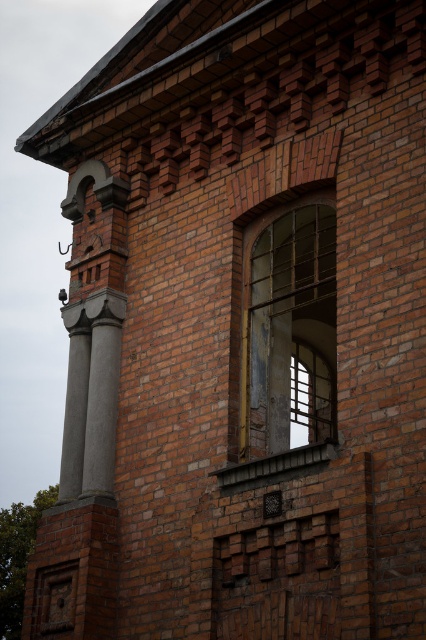
The image size is (426, 640). Identify the location of gray concrete column at left. (101, 390).

From the picture: Is gray concrete column at left to the left of smooth concrete column at center from the viewer's perspective?

No, gray concrete column at left is not to the left of smooth concrete column at center.

Is point (112, 392) positioned in front of point (69, 436)?

Yes, it is in front of point (69, 436).

Locate an element on the screen. gray concrete column at left is located at coordinates (101, 390).

Is translucent glass window at center shorter than gray concrete column at left?

Incorrect, translucent glass window at center's height does not fall short of gray concrete column at left's.

Looking at this image, can you confirm if translucent glass window at center is positioned to the left of gray concrete column at left?

No, translucent glass window at center is not to the left of gray concrete column at left.

Is point (241, 358) positioned after point (97, 298)?

No.

This screenshot has width=426, height=640. In order to click on translucent glass window at center in this screenshot , I will do `click(288, 326)`.

From the picture: Is translucent glass window at center positioned before smooth concrete column at center?

Yes, translucent glass window at center is in front of smooth concrete column at center.

Is point (270, 408) behind point (80, 365)?

No.

Locate an element on the screen. translucent glass window at center is located at coordinates (288, 326).